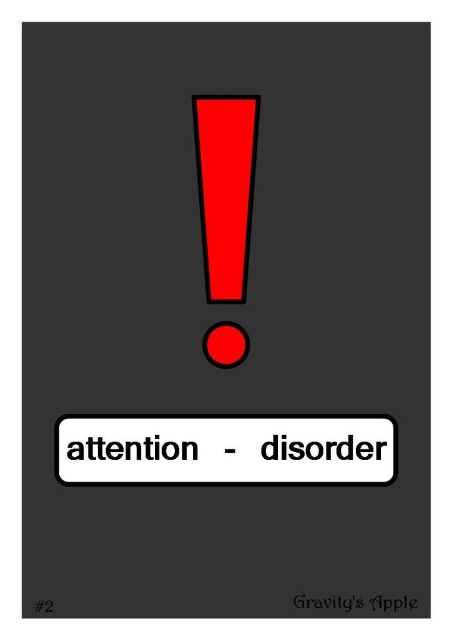
Between point (160, 472) and point (213, 332), which one is positioned in front?

Point (160, 472)

At what (x,y) coordinates should I click in order to perform the action: click on white matte rectangle at center. Please return your answer as a coordinate pair (x, y). This screenshot has width=452, height=640. Looking at the image, I should click on (225, 449).

The image size is (452, 640). I want to click on white matte rectangle at center, so click(x=225, y=449).